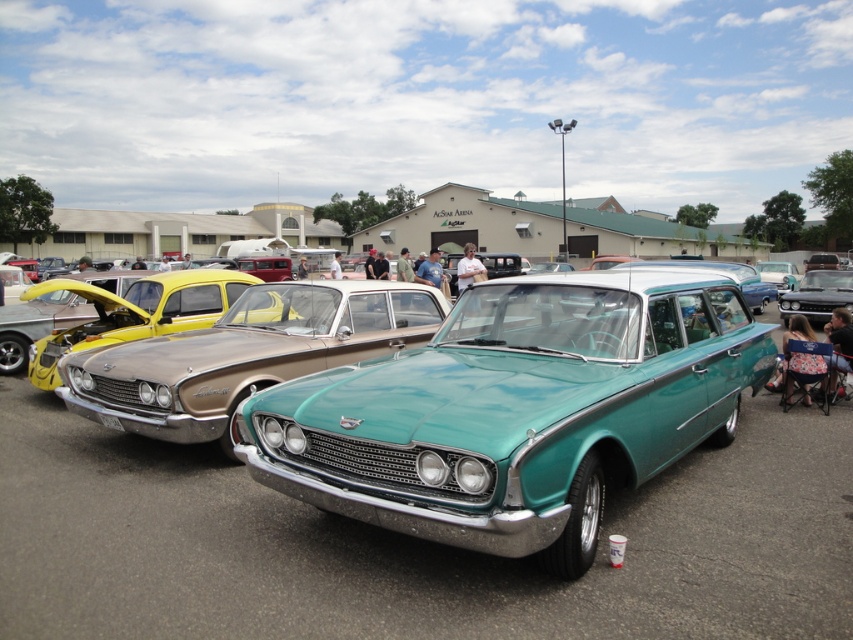
Question: Can you confirm if teal glossy car at center is positioned to the left of gold metallic sedan at center?

Choices:
 (A) no
 (B) yes

Answer: (A)

Question: Estimate the real-world distances between objects in this image. Which object is farther from the gold metallic sedan at center?

Choices:
 (A) shiny black car at center
 (B) teal glossy car at center

Answer: (A)

Question: Can you confirm if gold metallic sedan at center is positioned below shiny black car at center?

Choices:
 (A) yes
 (B) no

Answer: (A)

Question: Which object is the farthest from the shiny black car at center?

Choices:
 (A) teal glossy car at center
 (B) gold metallic sedan at center

Answer: (B)

Question: Is teal glossy car at center below shiny black car at center?

Choices:
 (A) yes
 (B) no

Answer: (A)

Question: Among these objects, which one is nearest to the camera?

Choices:
 (A) shiny black car at center
 (B) teal glossy car at center
 (C) gold metallic sedan at center

Answer: (B)